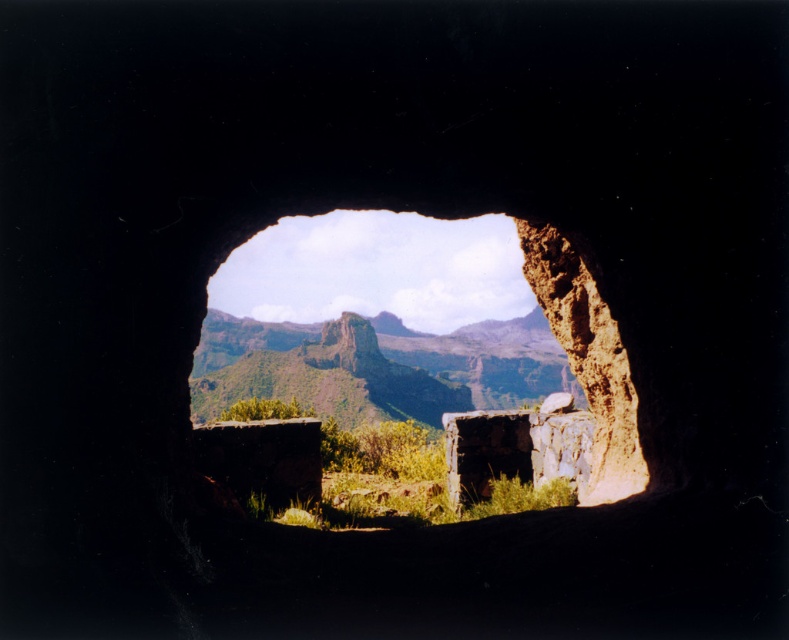
You are standing outside and looking through the brown rocky cave at center towards the green grassy mountain at center. Which object is higher in your field of view?

The brown rocky cave at center is higher in your field of view because it is located above the green grassy mountain at center.

You are standing at the cave entrance and notice two points marked in the scene. The first point is at coordinates point (343, 326) and the second is at point (208, 381). Which point is closer to you as you face the cave entrance?

Point (208, 381) is closer to you because it is in front of point (343, 326).